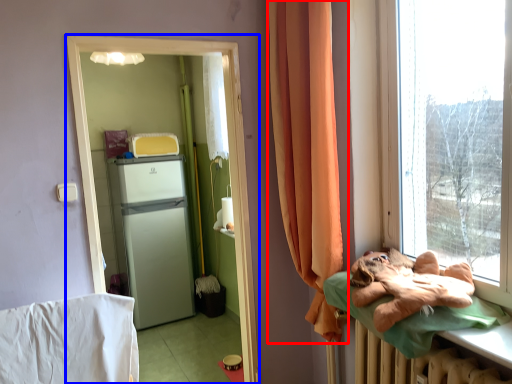
Question: Which object appears farthest to the camera in this image, curtain (highlighted by a red box) or screen door (highlighted by a blue box)?

Choices:
 (A) curtain
 (B) screen door

Answer: (B)